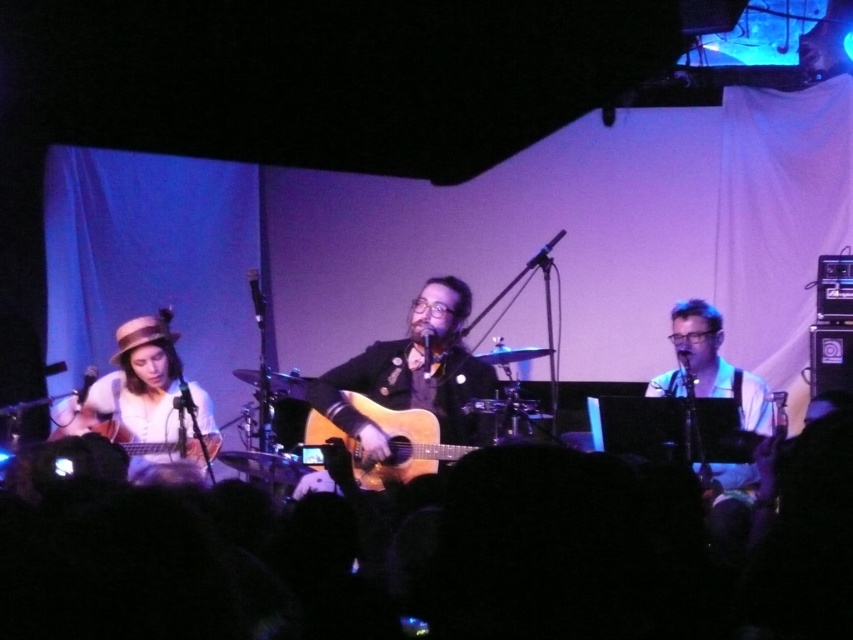
Is matte white shirt at left to the right of acoustic wood guitar at center from the viewer's perspective?

No, matte white shirt at left is not to the right of acoustic wood guitar at center.

Is matte white shirt at left to the left of acoustic wood guitar at center from the viewer's perspective?

Indeed, matte white shirt at left is positioned on the left side of acoustic wood guitar at center.

Between point (183, 412) and point (451, 449), which one is positioned in front?

Point (451, 449)

You are a GUI agent. You are given a task and a screenshot of the screen. Output one action in this format:
    pyautogui.click(x=<x>, y=<y>)
    Task: Click on the matte white shirt at left
    The height and width of the screenshot is (640, 853).
    Given the screenshot: What is the action you would take?
    pyautogui.click(x=148, y=401)

How much distance is there between white fabric shirt at right and matte wood guitar at left?

white fabric shirt at right and matte wood guitar at left are 7.70 feet apart.

Is white fabric shirt at right further to camera compared to matte wood guitar at left?

No.

Between point (749, 476) and point (213, 438), which one is positioned in front?

Point (749, 476) is more forward.

I want to click on white fabric shirt at right, so click(x=711, y=368).

Who is positioned more to the right, acoustic wood guitar at center or matte wood guitar at left?

acoustic wood guitar at center is more to the right.

Where is `acoustic wood guitar at center`? acoustic wood guitar at center is located at coordinates (387, 442).